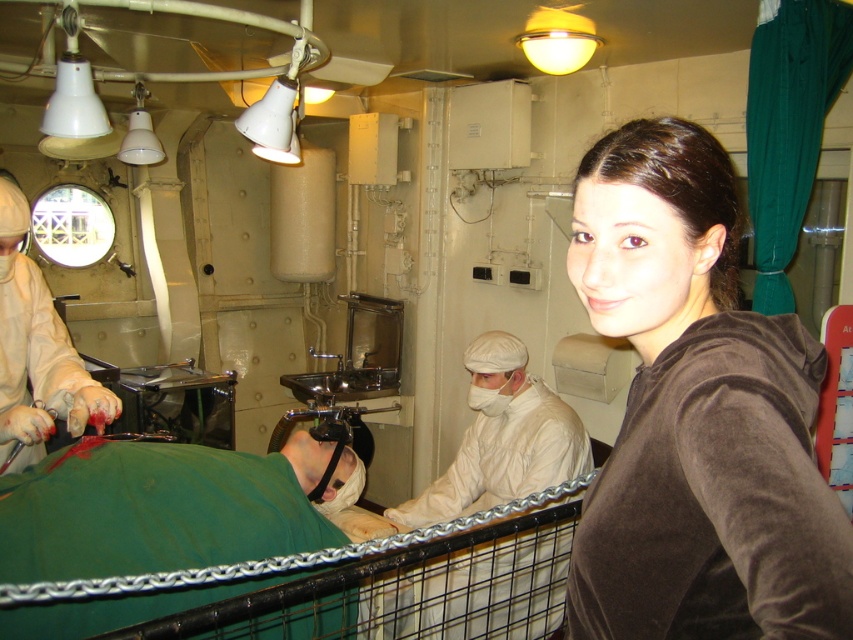
You are standing in the medical area and want to reach the brown velvety shirt at upper right located at point (695,413). The metal chain link barrier is in your way. Can you go around the barrier to reach it?

The brown velvety shirt at upper right is located at point (695,413). Since the barrier is between you and the shirt, you would need to go around it to reach it. However, the description does not specify the barrier layout or pathways, so it is uncertain if going around is possible.

You are a medical student standing in the surgical area and need to reach the brown velvety shirt at upper right to retrieve a tool. Given that you are 6 feet tall, can you comfortably reach it without needing a stool?

The brown velvety shirt at upper right is 20.57 inches away from the camera, which is within comfortable reaching distance for someone 6 feet tall. You can reach it without needing a stool.

You are a medical assistant in the surgical area. You need to locate the brown velvety shirt at upper right. According to the coordinates provided, where exactly is it positioned?

The brown velvety shirt at upper right is positioned at coordinates point (695, 413).